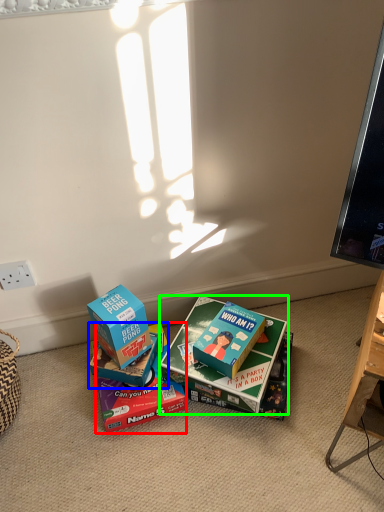
Question: Estimate the real-world distances between objects in this image. Which object is closer to box (highlighted by a red box), box (highlighted by a blue box) or box (highlighted by a green box)?

Choices:
 (A) box
 (B) box

Answer: (A)